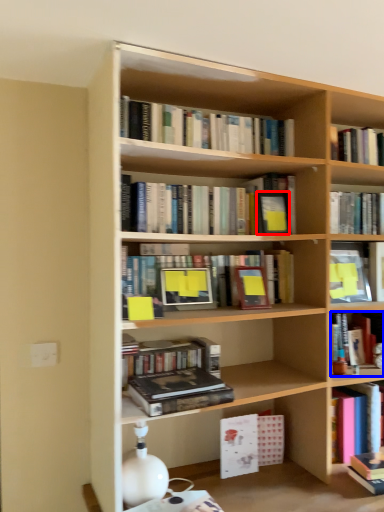
Question: Which of the following is the closest to the observer, paperback book (highlighted by a red box) or book (highlighted by a blue box)?

Choices:
 (A) paperback book
 (B) book

Answer: (A)